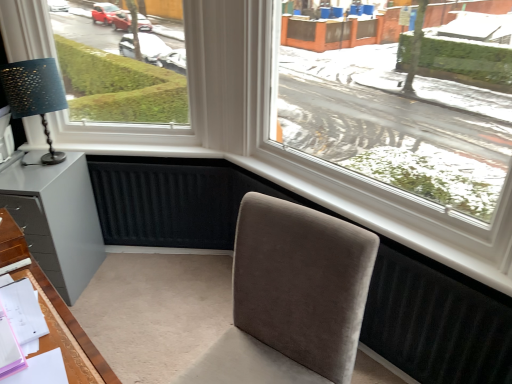
Question: Could you tell me if matte black lampshade at left is facing suede-like beige chair at center?

Choices:
 (A) no
 (B) yes

Answer: (A)

Question: Is matte black lampshade at left turned away from suede-like beige chair at center?

Choices:
 (A) yes
 (B) no

Answer: (B)

Question: Does matte black lampshade at left contain suede-like beige chair at center?

Choices:
 (A) yes
 (B) no

Answer: (B)

Question: Is matte black lampshade at left next to suede-like beige chair at center and touching it?

Choices:
 (A) yes
 (B) no

Answer: (B)

Question: From the image's perspective, is matte black lampshade at left located above suede-like beige chair at center?

Choices:
 (A) yes
 (B) no

Answer: (A)

Question: Is white plastic window at upper left bigger or smaller than suede-like beige chair at center?

Choices:
 (A) small
 (B) big

Answer: (B)

Question: From the image's perspective, relative to suede-like beige chair at center, is white plastic window at upper left above or below?

Choices:
 (A) above
 (B) below

Answer: (A)

Question: Is white plastic window at upper left wider or thinner than suede-like beige chair at center?

Choices:
 (A) thin
 (B) wide

Answer: (A)

Question: Considering their positions, is white plastic window at upper left located in front of or behind suede-like beige chair at center?

Choices:
 (A) front
 (B) behind

Answer: (B)

Question: In the image, is matte gray cabinet at lower left positioned in front of or behind transparent glass window at center?

Choices:
 (A) front
 (B) behind

Answer: (B)

Question: From a real-world perspective, is matte gray cabinet at lower left physically located above or below transparent glass window at center?

Choices:
 (A) below
 (B) above

Answer: (A)

Question: Is point (33, 228) closer or farther from the camera than point (282, 71)?

Choices:
 (A) farther
 (B) closer

Answer: (B)

Question: Which is correct: matte gray cabinet at lower left is inside transparent glass window at center, or outside of it?

Choices:
 (A) inside
 (B) outside

Answer: (B)

Question: Does point (198, 119) appear closer or farther from the camera than point (47, 152)?

Choices:
 (A) farther
 (B) closer

Answer: (A)

Question: From a real-world perspective, is white plastic window at upper left physically located above or below matte black lampshade at left?

Choices:
 (A) below
 (B) above

Answer: (B)